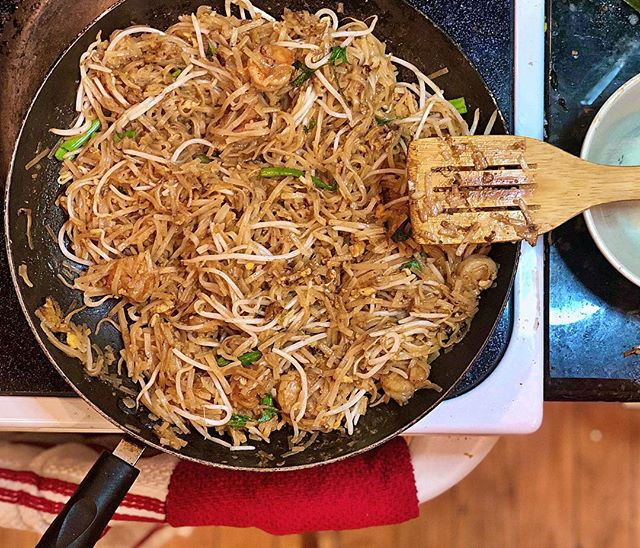
This screenshot has height=548, width=640. I want to click on bowl, so click(x=609, y=244).